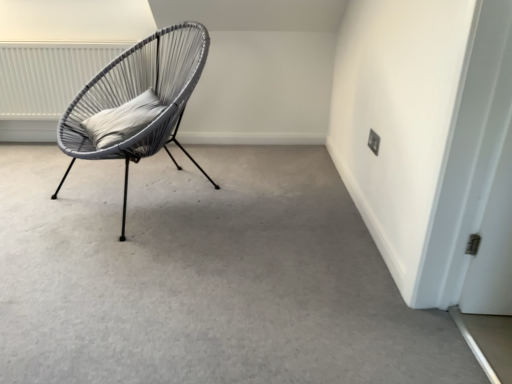
Question: Is white textured radiator at upper left smaller than black plastic electric outlet at upper right?

Choices:
 (A) yes
 (B) no

Answer: (B)

Question: Considering the relative sizes of white textured radiator at upper left and black plastic electric outlet at upper right in the image provided, is white textured radiator at upper left wider than black plastic electric outlet at upper right?

Choices:
 (A) no
 (B) yes

Answer: (B)

Question: Could black plastic electric outlet at upper right be considered to be inside white textured radiator at upper left?

Choices:
 (A) yes
 (B) no

Answer: (B)

Question: From a real-world perspective, is white textured radiator at upper left physically above black plastic electric outlet at upper right?

Choices:
 (A) yes
 (B) no

Answer: (A)

Question: Is white textured radiator at upper left touching black plastic electric outlet at upper right?

Choices:
 (A) no
 (B) yes

Answer: (A)

Question: Considering the relative positions of white soft cushion at center and matte gray carpet at center in the image provided, is white soft cushion at center to the left or to the right of matte gray carpet at center?

Choices:
 (A) left
 (B) right

Answer: (B)

Question: Looking at their shapes, would you say white soft cushion at center is wider or thinner than matte gray carpet at center?

Choices:
 (A) thin
 (B) wide

Answer: (A)

Question: Is white soft cushion at center situated inside matte gray carpet at center or outside?

Choices:
 (A) inside
 (B) outside

Answer: (B)

Question: Does point (99, 122) appear closer or farther from the camera than point (70, 192)?

Choices:
 (A) farther
 (B) closer

Answer: (B)

Question: Does point (371, 135) appear closer or farther from the camera than point (66, 145)?

Choices:
 (A) farther
 (B) closer

Answer: (A)

Question: Would you say black plastic electric outlet at upper right is to the left or to the right of matte grey wicker chair at left in the picture?

Choices:
 (A) left
 (B) right

Answer: (B)

Question: From the image's perspective, relative to matte grey wicker chair at left, is black plastic electric outlet at upper right above or below?

Choices:
 (A) below
 (B) above

Answer: (A)

Question: Is black plastic electric outlet at upper right taller or shorter than matte grey wicker chair at left?

Choices:
 (A) short
 (B) tall

Answer: (A)

Question: Visually, is matte grey wicker chair at left positioned to the left or to the right of white soft cushion at center?

Choices:
 (A) left
 (B) right

Answer: (B)

Question: In the image, is matte grey wicker chair at left positioned in front of or behind white soft cushion at center?

Choices:
 (A) front
 (B) behind

Answer: (A)